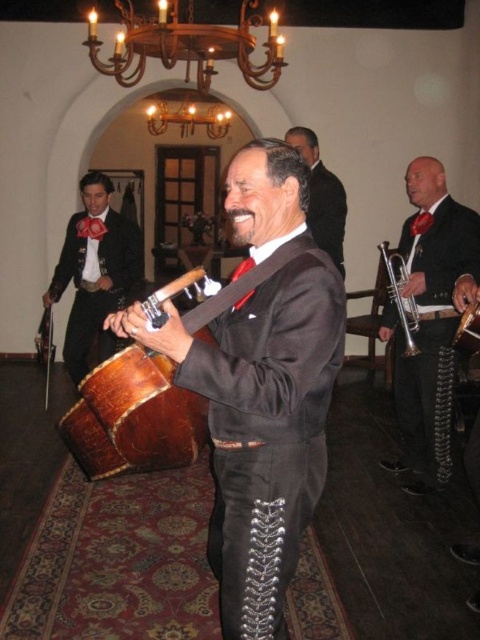
Question: Does wooden drum at center have a greater width compared to black satin tie at center?

Choices:
 (A) no
 (B) yes

Answer: (B)

Question: Considering the real-world distances, which object is closest to the shiny black mariachi outfit at center?

Choices:
 (A) black satin tie at center
 (B) wooden drum at center

Answer: (B)

Question: Which object appears closest to the camera in this image?

Choices:
 (A) shiny black suit at center
 (B) leather drum at center

Answer: (B)

Question: Observing the image, what is the correct spatial positioning of shiny black suit at left in reference to gold-bronze chandelier at upper center?

Choices:
 (A) right
 (B) left

Answer: (B)

Question: Which point is farther to the camera?

Choices:
 (A) (316, 141)
 (B) (78, 460)
 (C) (412, 308)

Answer: (A)

Question: Does leather drum at center appear on the right side of silver metallic trumpet at right?

Choices:
 (A) yes
 (B) no

Answer: (B)